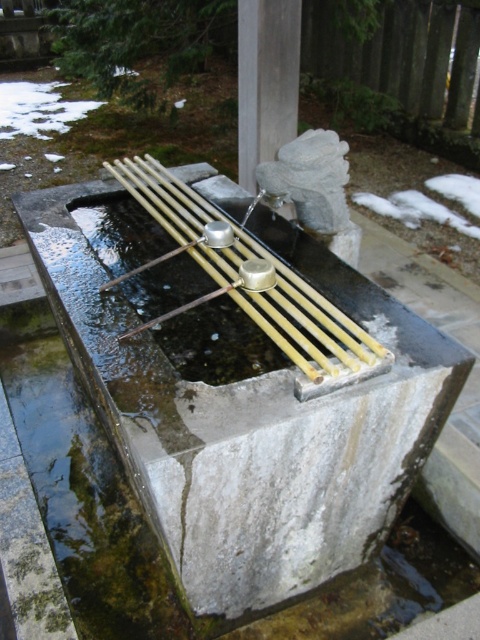
Question: Is yellow bamboo sticks at center further to camera compared to smooth gray stone at center?

Choices:
 (A) no
 (B) yes

Answer: (A)

Question: Is yellow bamboo sticks at center wider than smooth gray stone at center?

Choices:
 (A) no
 (B) yes

Answer: (B)

Question: Which of these objects is positioned closest to the smooth gray stone at center?

Choices:
 (A) smooth concrete basin at center
 (B) yellow bamboo sticks at center

Answer: (B)

Question: Is the position of smooth concrete basin at center more distant than that of yellow bamboo sticks at center?

Choices:
 (A) yes
 (B) no

Answer: (B)

Question: Which object appears farthest from the camera in this image?

Choices:
 (A) smooth concrete basin at center
 (B) yellow bamboo sticks at center

Answer: (B)

Question: Among these points, which one is farthest from the camera?

Choices:
 (A) (287, 305)
 (B) (294, 24)

Answer: (B)